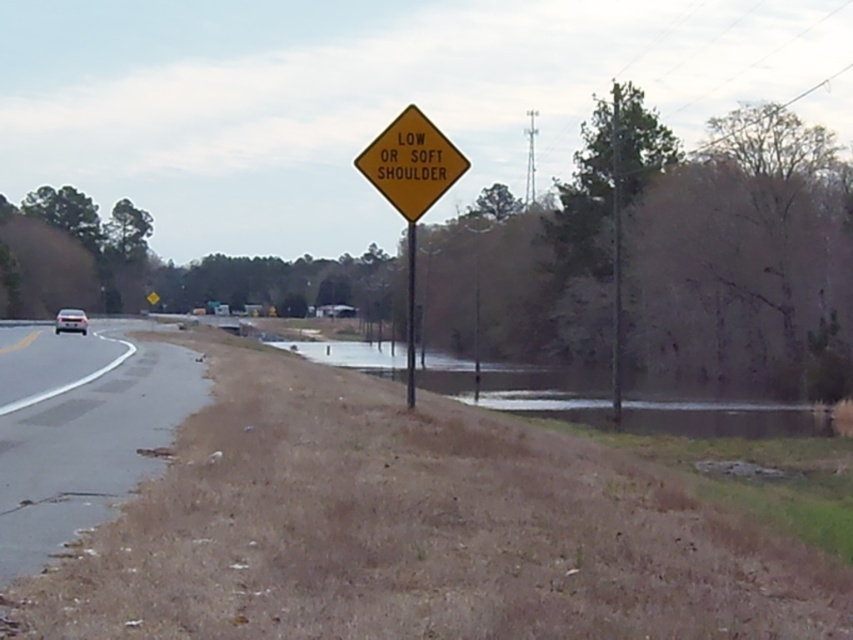
Question: In this image, where is brown dirt at lower center located relative to metallic pole at center?

Choices:
 (A) below
 (B) above

Answer: (A)

Question: Among these objects, which one is nearest to the camera?

Choices:
 (A) asphalt road at left
 (B) brown dirt at lower center

Answer: (A)

Question: Is asphalt road at left wider than metallic pole at center?

Choices:
 (A) yes
 (B) no

Answer: (A)

Question: Does asphalt road at left come behind yellow diamond-shaped sign at center?

Choices:
 (A) no
 (B) yes

Answer: (A)

Question: Which is farther from the asphalt road at left?

Choices:
 (A) yellow diamond-shaped sign at center
 (B) metallic pole at center
 (C) silver metallic car at left

Answer: (C)

Question: Which of the following is the closest to the observer?

Choices:
 (A) (68, 316)
 (B) (415, 148)
 (C) (566, 388)

Answer: (B)